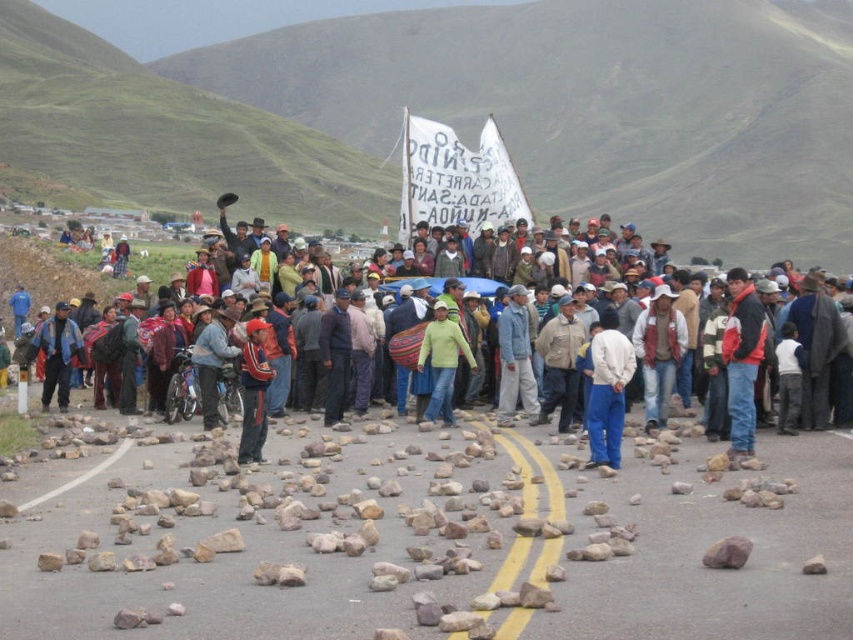
Can you confirm if jeans at center is smaller than red jacket at center?

Incorrect, jeans at center is not smaller in size than red jacket at center.

Does jeans at center have a larger size compared to red jacket at center?

Indeed, jeans at center has a larger size compared to red jacket at center.

Is point (16, 317) behind point (735, 276)?

Yes, point (16, 317) is farther from viewer.

Where is `jeans at center`? jeans at center is located at coordinates (44, 284).

Is point (450, 392) positioned before point (257, 445)?

No, (450, 392) is further to viewer.

Is light green sweater at center above red fabric backpack at center?

Correct, light green sweater at center is located above red fabric backpack at center.

At what (x,y) coordinates should I click in order to perform the action: click on light green sweater at center. Please return your answer as a coordinate pair (x, y). This screenshot has width=853, height=640. Looking at the image, I should click on (442, 362).

Is the position of jeans at center less distant than that of light green sweater at center?

Yes, jeans at center is closer to the viewer.

Does point (77, 292) lie behind point (432, 330)?

Yes.

Is point (4, 256) farther from camera compared to point (447, 424)?

Yes, point (4, 256) is behind point (447, 424).

Where is `jeans at center`? jeans at center is located at coordinates (44, 284).